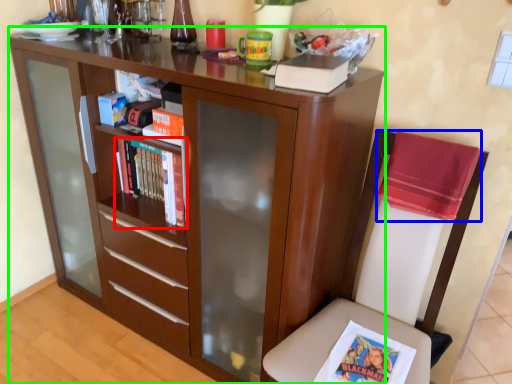
Question: Considering the real-world distances, which object is closest to book (highlighted by a red box)? cloth (highlighted by a blue box) or bookcase (highlighted by a green box).

Choices:
 (A) cloth
 (B) bookcase

Answer: (B)